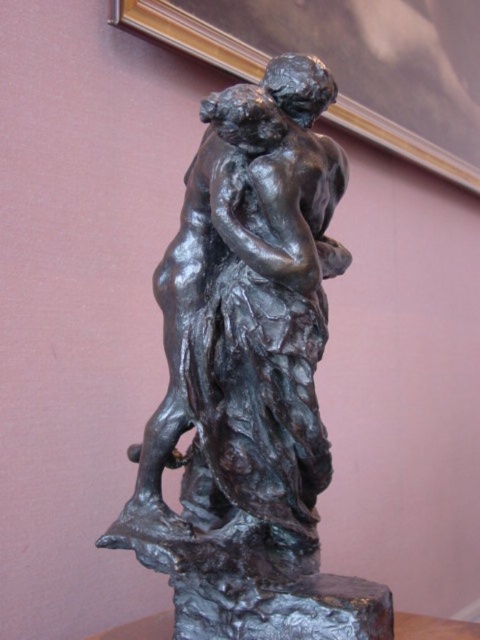
You are standing in front of the bronze sculpture and want to take a photo. You notice two points on the sculpture labeled as point [252,196] and point [384,49]. Which point should you focus on first if you want to capture the part of the sculpture closest to the camera?

Point [252,196] is closer to the camera than point [384,49], so you should focus on point [252,196] first to capture the closest part of the sculpture.

You are standing in front of the bronze statue at center and want to take a photo of it. If your camera can focus on objects up to 35 inches away, will you need to step back to get a clear photo?

The bronze statue at center is 36.71 inches from the camera. Since your camera can focus up to 35 inches, you need to step back to increase the distance so the statue is within the camera range.